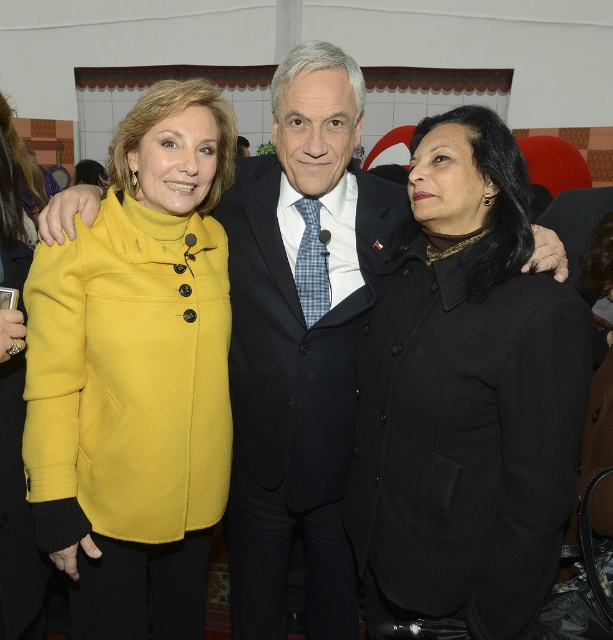
You are a photographer adjusting the camera focus. You need to focus on the person wearing the black wool coat at center and the dark blue wool suit at center. Which one should you focus on first to ensure both are in focus?

You should focus on the black wool coat at center first since it is closer to the viewer than the dark blue wool suit at center, ensuring proper focus on both by starting with the closer subject.

You are a photographer at the event and need to adjust the lighting to ensure both the yellow woolen coat at left and the dark blue wool suit at center are well lit. Considering their sizes, which one might require more focused lighting adjustments?

The yellow woolen coat at left has a smaller size compared to the dark blue wool suit at center, so it might require more focused lighting adjustments to ensure it is adequately lit alongside the larger suit.

You are standing in front of the three people in the image and want to touch the point at coordinate point (x=473, y=186) and point (x=147, y=211). Which point would require you to reach further forward?

Point (x=147, y=211) is further away from the camera, so you would need to reach further forward to touch it compared to point (x=473, y=186).